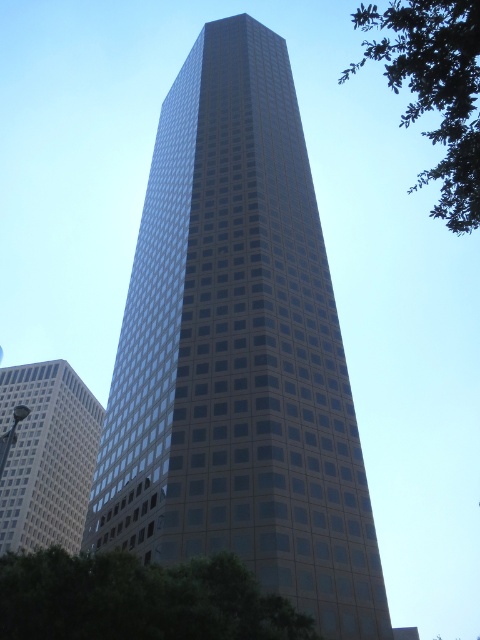
Can you confirm if glassy reflective skyscraper at center is taller than white glass building at left?

Yes.

Does point (165, 246) come closer to viewer compared to point (38, 486)?

That is True.

The height and width of the screenshot is (640, 480). I want to click on glassy reflective skyscraper at center, so click(238, 353).

In the scene shown: Does green leafy tree at lower left appear under green leafy tree at upper right?

Indeed, green leafy tree at lower left is positioned under green leafy tree at upper right.

The width and height of the screenshot is (480, 640). What do you see at coordinates (139, 600) in the screenshot?
I see `green leafy tree at lower left` at bounding box center [139, 600].

Does point (126, 636) lie in front of point (432, 26)?

No.

This screenshot has width=480, height=640. Find the location of `green leafy tree at lower left`. green leafy tree at lower left is located at coordinates (139, 600).

Can you confirm if glassy reflective skyscraper at center is smaller than green leafy tree at lower left?

No, glassy reflective skyscraper at center is not smaller than green leafy tree at lower left.

Between glassy reflective skyscraper at center and green leafy tree at lower left, which one is positioned lower?

green leafy tree at lower left

This screenshot has width=480, height=640. What do you see at coordinates (238, 353) in the screenshot?
I see `glassy reflective skyscraper at center` at bounding box center [238, 353].

Find the location of a particular element. This screenshot has height=640, width=480. glassy reflective skyscraper at center is located at coordinates (238, 353).